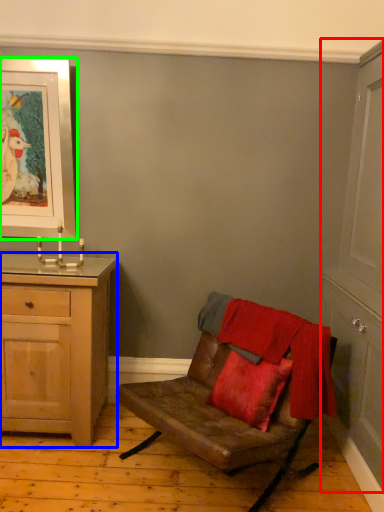
Question: Based on their relative distances, which object is farther from cabinetry (highlighted by a red box)? Choose from chest of drawers (highlighted by a blue box) and picture frame (highlighted by a green box).

Choices:
 (A) chest of drawers
 (B) picture frame

Answer: (B)